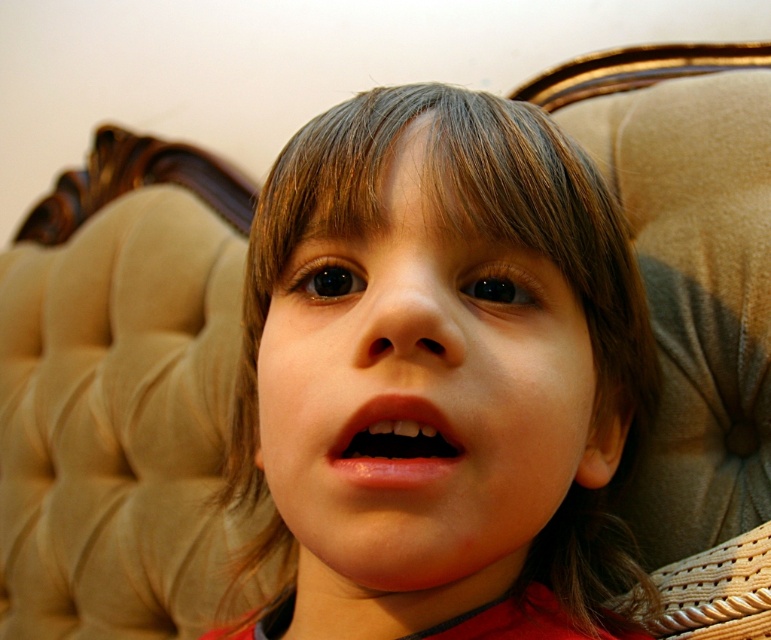
Question: Which of the following is the closest to the observer?

Choices:
 (A) (497, 305)
 (B) (436, 445)

Answer: (B)

Question: Among these objects, which one is farthest from the camera?

Choices:
 (A) smooth skin face at center
 (B) pink glossy lips at center

Answer: (B)

Question: From the image, what is the correct spatial relationship of smooth skin face at center in relation to pink glossy lips at center?

Choices:
 (A) above
 (B) below

Answer: (A)

Question: Does smooth skin face at center have a larger size compared to pink glossy lips at center?

Choices:
 (A) yes
 (B) no

Answer: (A)

Question: Which of the following is the closest to the observer?

Choices:
 (A) (379, 480)
 (B) (534, 275)

Answer: (A)

Question: From the image, what is the correct spatial relationship of smooth skin face at center in relation to pink glossy lips at center?

Choices:
 (A) left
 (B) right

Answer: (B)